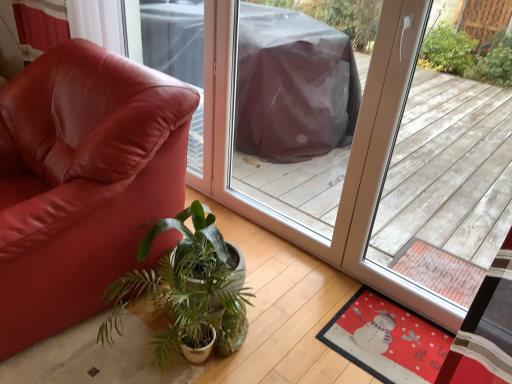
Identify the location of green leafy plant at center. (183, 286).

You are a GUI agent. You are given a task and a screenshot of the screen. Output one action in this format:
    pyautogui.click(x=<x>, y=<y>)
    Task: Click on the red felt mat at lower right
    Image resolution: width=512 pixels, height=384 pixels.
    Given the screenshot: What is the action you would take?
    pyautogui.click(x=387, y=339)

Is green leafy plant at center next to matte leather chair at left and touching it?

No, green leafy plant at center is not next to matte leather chair at left.

From the image's perspective, which object appears higher, green leafy plant at center or matte leather chair at left?

matte leather chair at left is shown above in the image.

Could matte leather chair at left be considered to be inside green leafy plant at center?

That's incorrect, matte leather chair at left is not inside green leafy plant at center.

Who is bigger, green leafy plant at center or matte leather chair at left?

matte leather chair at left.

Is red felt mat at lower right looking in the opposite direction of green leafy plant at center?

No, red felt mat at lower right's orientation is not away from green leafy plant at center.

Is red felt mat at lower right not near green leafy plant at center?

That's not correct — red felt mat at lower right is a little close to green leafy plant at center.

From the image's perspective, is red felt mat at lower right over green leafy plant at center?

Incorrect, from the image's perspective, red felt mat at lower right is lower than green leafy plant at center.

Is red felt mat at lower right at the right side of green leafy plant at center?

Indeed, red felt mat at lower right is positioned on the right side of green leafy plant at center.

Measure the distance from matte leather chair at left to red felt mat at lower right.

matte leather chair at left is 3.50 feet from red felt mat at lower right.

From a real-world perspective, which is physically below, matte leather chair at left or red felt mat at lower right?

red felt mat at lower right.

Relative to red felt mat at lower right, is matte leather chair at left in front or behind?

Visually, matte leather chair at left is located in front of red felt mat at lower right.

Consider the image. Does matte leather chair at left touch red felt mat at lower right?

No.

Which of these two, red felt mat at lower right or matte leather chair at left, is wider?

Wider between the two is matte leather chair at left.

From a real-world perspective, is red felt mat at lower right physically located above or below matte leather chair at left?

red felt mat at lower right is below matte leather chair at left.

Is red felt mat at lower right behind matte leather chair at left?

Yes, red felt mat at lower right is further from the viewer.

Does green leafy plant at center lie behind red felt mat at lower right?

No, green leafy plant at center is in front of red felt mat at lower right.

From a real-world perspective, is green leafy plant at center positioned above or below red felt mat at lower right?

green leafy plant at center is situated higher than red felt mat at lower right in the real world.

Between green leafy plant at center and red felt mat at lower right, which one has smaller size?

Smaller between the two is red felt mat at lower right.

Which of these two, green leafy plant at center or red felt mat at lower right, is thinner?

With smaller width is green leafy plant at center.

From the image's perspective, does matte leather chair at left appear lower than green leafy plant at center?

No, from the image's perspective, matte leather chair at left is not below green leafy plant at center.

Does point (9, 256) appear closer or farther from the camera than point (241, 306)?

Point (9, 256).

Which is behind, matte leather chair at left or green leafy plant at center?

green leafy plant at center is behind.

Would you say matte leather chair at left is inside or outside green leafy plant at center?

matte leather chair at left is not inside green leafy plant at center, it's outside.

The image size is (512, 384). I want to click on chair on the left of green leafy plant at center, so click(x=81, y=182).

Where is `mat lying behind the green leafy plant at center`? Image resolution: width=512 pixels, height=384 pixels. mat lying behind the green leafy plant at center is located at coordinates (387, 339).

Looking at the image, which one is located closer to green leafy plant at center, matte leather chair at left or red felt mat at lower right?

matte leather chair at left lies closer to green leafy plant at center than the other object.

Based on their spatial positions, is green leafy plant at center or red felt mat at lower right further from matte leather chair at left?

Based on the image, red felt mat at lower right appears to be further to matte leather chair at left.

Which object lies further to the anchor point green leafy plant at center, red felt mat at lower right or matte leather chair at left?

red felt mat at lower right is positioned further to the anchor green leafy plant at center.

From the image, which object appears to be nearer to red felt mat at lower right, green leafy plant at center or matte leather chair at left?

green leafy plant at center.

Based on their spatial positions, is red felt mat at lower right or green leafy plant at center further from matte leather chair at left?

The object further to matte leather chair at left is red felt mat at lower right.

Looking at the image, which one is located closer to red felt mat at lower right, matte leather chair at left or green leafy plant at center?

Based on the image, green leafy plant at center appears to be nearer to red felt mat at lower right.

Locate an element on the screen. This screenshot has width=512, height=384. houseplant between matte leather chair at left and red felt mat at lower right in the horizontal direction is located at coordinates (183, 286).